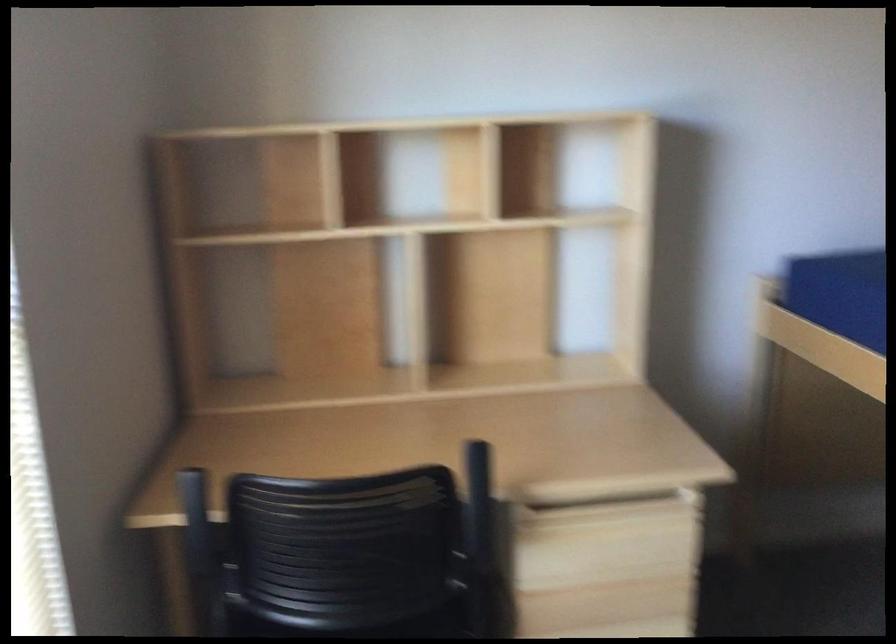
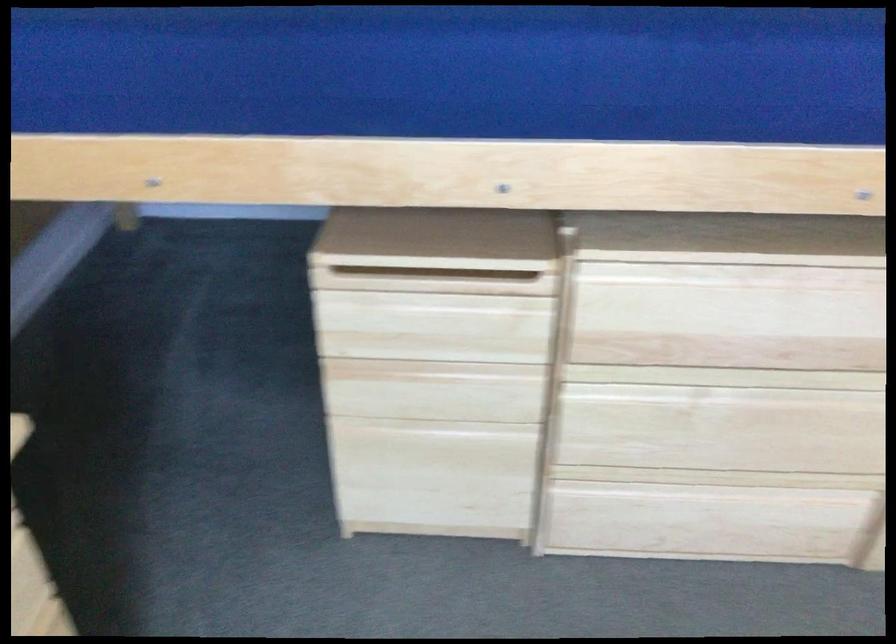
The images are taken continuously from a first-person perspective. In which direction is your viewpoint rotating?

The camera rotated toward right-down.